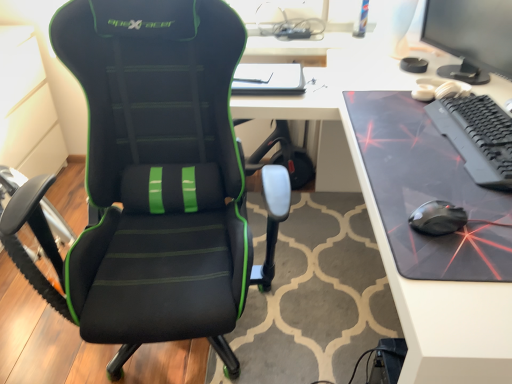
You are a GUI agent. You are given a task and a screenshot of the screen. Output one action in this format:
    pyautogui.click(x=<x>, y=<y>)
    Task: Click on the black matte keyboard at right
    The height and width of the screenshot is (384, 512).
    Given the screenshot: What is the action you would take?
    pyautogui.click(x=477, y=136)

What are the coordinates of `matte black monitor at upper right` in the screenshot? It's located at (472, 31).

Measure the distance between point (327, 40) and camera.

The depth of point (327, 40) is 6.30 feet.

Find the location of `black matte keyboard at right`. black matte keyboard at right is located at coordinates (477, 136).

Does matte black monitor at upper right turn towards transparent plastic mousepad at right?

No, matte black monitor at upper right does not turn towards transparent plastic mousepad at right.

Is point (467, 50) more distant than point (436, 55)?

No, it is not.

In order to click on desk in front of the matte black monitor at upper right in this screenshot , I will do `click(382, 224)`.

Looking at this image, is matte black monitor at upper right inside the boundaries of transparent plastic mousepad at right, or outside?

matte black monitor at upper right exists outside the volume of transparent plastic mousepad at right.

Is black matte keyboard at right taller or shorter than transparent plastic mousepad at right?

Clearly, black matte keyboard at right is shorter compared to transparent plastic mousepad at right.

The width and height of the screenshot is (512, 384). I want to click on computer keyboard to the right of transparent plastic mousepad at right, so click(477, 136).

From a real-world perspective, is black matte keyboard at right positioned above or below transparent plastic mousepad at right?

Clearly, from a real-world perspective, black matte keyboard at right is above transparent plastic mousepad at right.

How far apart are black matte keyboard at right and transparent plastic mousepad at right?

The distance of black matte keyboard at right from transparent plastic mousepad at right is 14.22 inches.

In the scene shown: From a real-world perspective, which is physically above, black matte keyboard at right or matte black monitor at upper right?

matte black monitor at upper right is physically above.

Is black matte keyboard at right taller than matte black monitor at upper right?

In fact, black matte keyboard at right may be shorter than matte black monitor at upper right.

In terms of size, does black matte keyboard at right appear bigger or smaller than matte black monitor at upper right?

Considering their sizes, black matte keyboard at right takes up less space than matte black monitor at upper right.

In the scene shown: Is black matte keyboard at right positioned with its back to matte black monitor at upper right?

No, black matte keyboard at right is not facing the opposite direction of matte black monitor at upper right.

Is black leather chair at left inside matte black monitor at upper right?

No, black leather chair at left is not surrounded by matte black monitor at upper right.

Which is more to the right, matte black monitor at upper right or black leather chair at left?

matte black monitor at upper right is more to the right.

This screenshot has width=512, height=384. Find the location of `chair on the left of matte black monitor at upper right`. chair on the left of matte black monitor at upper right is located at coordinates (153, 180).

Considering the sizes of objects matte black monitor at upper right and black leather chair at left in the image provided, who is thinner, matte black monitor at upper right or black leather chair at left?

matte black monitor at upper right.

Consider the image. From the image's perspective, is matte black monitor at upper right beneath black matte keyboard at right?

No, from the image's perspective, matte black monitor at upper right is not below black matte keyboard at right.

Is matte black monitor at upper right in front of or behind black matte keyboard at right in the image?

In the image, matte black monitor at upper right appears behind black matte keyboard at right.

Does matte black monitor at upper right touch black matte keyboard at right?

matte black monitor at upper right is not next to black matte keyboard at right, and they're not touching.

From the picture: Which point is more forward, (497,36) or (452,100)?

The point (452,100) is more forward.

In the scene shown: Is transparent plastic mousepad at right in contact with matte black monitor at upper right?

No, transparent plastic mousepad at right is not touching matte black monitor at upper right.

Is transparent plastic mousepad at right at the left side of matte black monitor at upper right?

Yes, transparent plastic mousepad at right is to the left of matte black monitor at upper right.

Is transparent plastic mousepad at right taller than matte black monitor at upper right?

Yes.

Between transparent plastic mousepad at right and matte black monitor at upper right, which one has larger size?

transparent plastic mousepad at right is bigger.

Is black glossy mouse at right aimed at black leather chair at left?

No, black glossy mouse at right is not facing towards black leather chair at left.

Considering the positions of objects black glossy mouse at right and black leather chair at left in the image provided, who is more to the right, black glossy mouse at right or black leather chair at left?

Positioned to the right is black glossy mouse at right.

The image size is (512, 384). I want to click on chair that is under the black glossy mouse at right (from a real-world perspective), so click(x=153, y=180).

Considering the relative sizes of black glossy mouse at right and black leather chair at left in the image provided, is black glossy mouse at right bigger than black leather chair at left?

No, black glossy mouse at right is not bigger than black leather chair at left.

Where is `desk below the matte black monitor at upper right (from a real-world perspective)`? The height and width of the screenshot is (384, 512). desk below the matte black monitor at upper right (from a real-world perspective) is located at coordinates (382, 224).

At what (x,y) coordinates should I click in order to perform the action: click on desk that is in front of the black matte keyboard at right. Please return your answer as a coordinate pair (x, y). This screenshot has height=384, width=512. Looking at the image, I should click on (382, 224).

Estimate the real-world distances between objects in this image. Which object is further from black glossy mouse at right, transparent plastic mousepad at right or black matte keyboard at right?

The object further to black glossy mouse at right is transparent plastic mousepad at right.

Based on their spatial positions, is black leather chair at left or matte black monitor at upper right further from transparent plastic mousepad at right?

The object further to transparent plastic mousepad at right is black leather chair at left.

From the image, which object appears to be farther from black matte keyboard at right, transparent plastic mousepad at right or black glossy mouse at right?

transparent plastic mousepad at right.

Based on their spatial positions, is black leather chair at left or transparent plastic mousepad at right further from black matte keyboard at right?

The object further to black matte keyboard at right is black leather chair at left.

Which object lies nearer to the anchor point matte black monitor at upper right, transparent plastic mousepad at right or black glossy mouse at right?

transparent plastic mousepad at right is closer to matte black monitor at upper right.

Looking at the image, which one is located closer to matte black monitor at upper right, black matte keyboard at right or black leather chair at left?

black matte keyboard at right.

From the image, which object appears to be nearer to matte black monitor at upper right, black glossy mouse at right or black matte keyboard at right?

Among the two, black matte keyboard at right is located nearer to matte black monitor at upper right.

Which object lies further to the anchor point black glossy mouse at right, black matte keyboard at right or black leather chair at left?

black leather chair at left is further to black glossy mouse at right.

Find the location of a particular element. desk between black leather chair at left and black matte keyboard at right is located at coordinates (382, 224).

The width and height of the screenshot is (512, 384). What are the coordinates of `computer keyboard between black leather chair at left and matte black monitor at upper right` in the screenshot? It's located at (477, 136).

At what (x,y) coordinates should I click in order to perform the action: click on mouse between matte black monitor at upper right and transparent plastic mousepad at right vertically. Please return your answer as a coordinate pair (x, y). This screenshot has width=512, height=384. Looking at the image, I should click on (438, 218).

This screenshot has height=384, width=512. Identify the location of mouse positioned between transparent plastic mousepad at right and black matte keyboard at right from near to far. (438, 218).